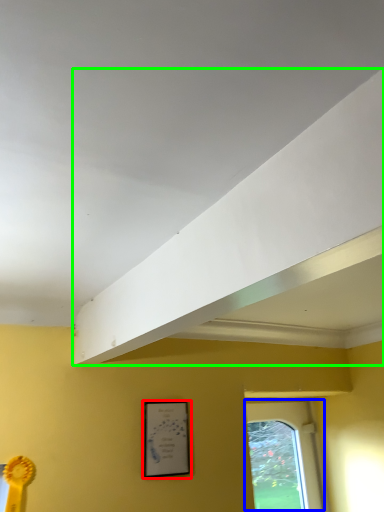
Question: Estimate the real-world distances between objects in this image. Which object is closer to picture frame (highlighted by a red box), window (highlighted by a blue box) or exhaust hood (highlighted by a green box)?

Choices:
 (A) window
 (B) exhaust hood

Answer: (B)